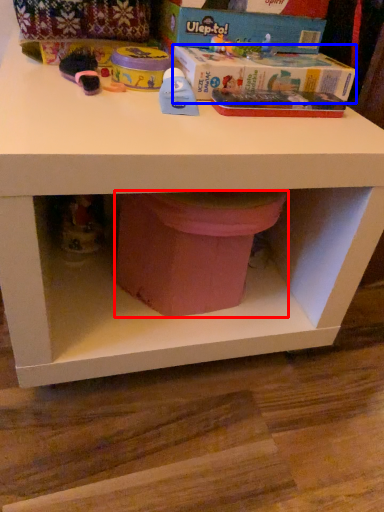
Question: Which point is further to the camera, potty (highlighted by a red box) or box (highlighted by a blue box)?

Choices:
 (A) potty
 (B) box

Answer: (B)